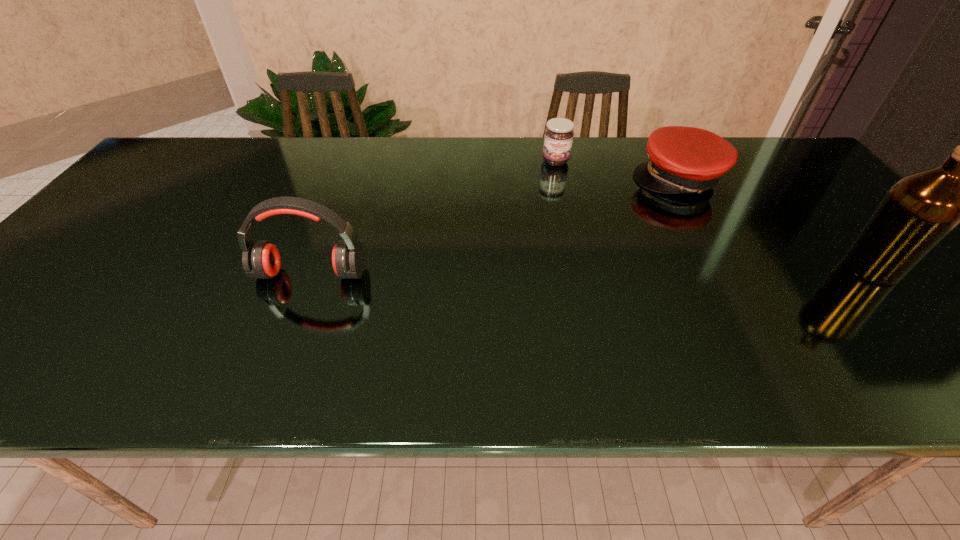
Find the location of a particular element. vacant space located on the front label of the jam is located at coordinates (564, 240).

Identify the location of vacant space located 0.380m on the front label of the jam. The width and height of the screenshot is (960, 540). (566, 253).

Where is `free space located 0.070m on the front label of the jam`? free space located 0.070m on the front label of the jam is located at coordinates (558, 181).

At what (x,y) coordinates should I click in order to perform the action: click on cap that is at the far edge. Please return your answer as a coordinate pair (x, y). This screenshot has width=960, height=540. Looking at the image, I should click on (682, 159).

You are a GUI agent. You are given a task and a screenshot of the screen. Output one action in this format:
    pyautogui.click(x=<x>, y=<y>)
    Task: Click on the jam at the far edge
    This screenshot has height=540, width=960.
    Given the screenshot: What is the action you would take?
    pyautogui.click(x=558, y=138)

Where is `object at the right edge`? The height and width of the screenshot is (540, 960). object at the right edge is located at coordinates (917, 212).

You are a GUI agent. You are given a task and a screenshot of the screen. Output one action in this format:
    pyautogui.click(x=<x>, y=<y>)
    Task: Click on the vacant area at the far edge of the desktop
    This screenshot has width=960, height=540.
    Given the screenshot: What is the action you would take?
    pyautogui.click(x=478, y=151)

Image resolution: width=960 pixels, height=540 pixels. Find the location of `free space at the near edge`. free space at the near edge is located at coordinates (405, 336).

In the image, there is a desktop. Where is `vacant region at the left edge`? vacant region at the left edge is located at coordinates (159, 192).

The height and width of the screenshot is (540, 960). Find the location of `free space at the far right corner of the desktop`. free space at the far right corner of the desktop is located at coordinates (744, 147).